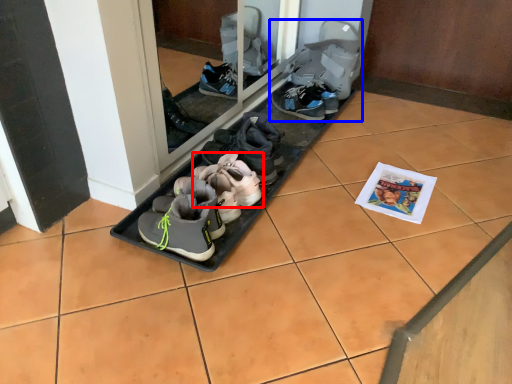
Question: Which object is closer to the camera taking this photo, footwear (highlighted by a red box) or footwear (highlighted by a blue box)?

Choices:
 (A) footwear
 (B) footwear

Answer: (A)